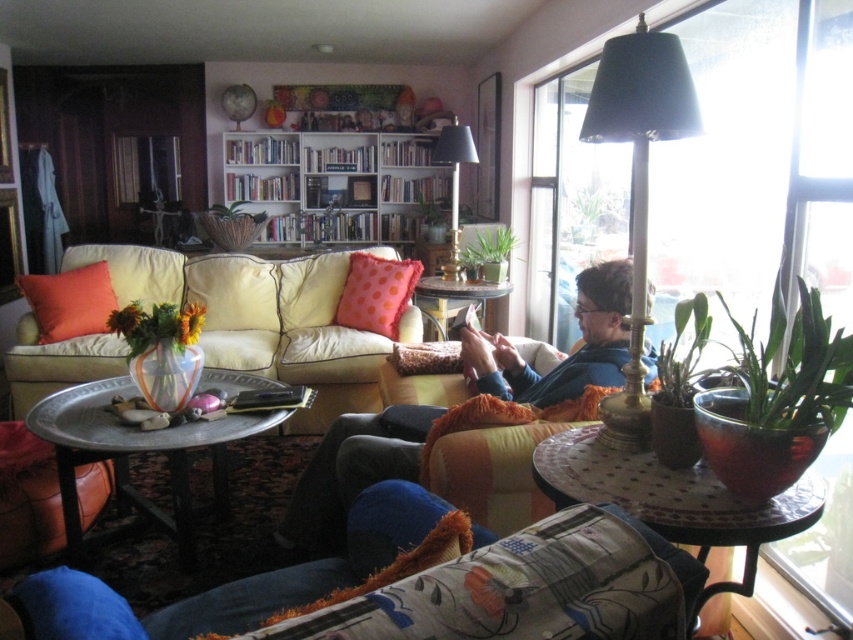
Question: Which of these objects is positioned closest to the light beige leather couch at left?

Choices:
 (A) orange fabric pillow at left
 (B) orange polka dot pillow at center
 (C) wooden bookshelf at upper center

Answer: (B)

Question: Can you confirm if fluffy blue cushion at lower left is smaller than orange fabric pillow at left?

Choices:
 (A) yes
 (B) no

Answer: (A)

Question: Considering the real-world distances, which object is farthest from the orange polka dot pillow at center?

Choices:
 (A) orange fabric pillow at left
 (B) wooden bookshelf at upper center
 (C) transparent glass window at upper right
 (D) fluffy blue cushion at lower left

Answer: (B)

Question: Is wooden bookshelf at upper center to the left of orange polka dot pillow at center from the viewer's perspective?

Choices:
 (A) no
 (B) yes

Answer: (B)

Question: Is light beige leather couch at left above orange fabric pillow at left?

Choices:
 (A) yes
 (B) no

Answer: (A)

Question: Which of the following is the farthest from the observer?

Choices:
 (A) orange fabric pillow at left
 (B) wooden bookshelf at upper center
 (C) fluffy blue cushion at lower left
 (D) orange polka dot pillow at center

Answer: (B)